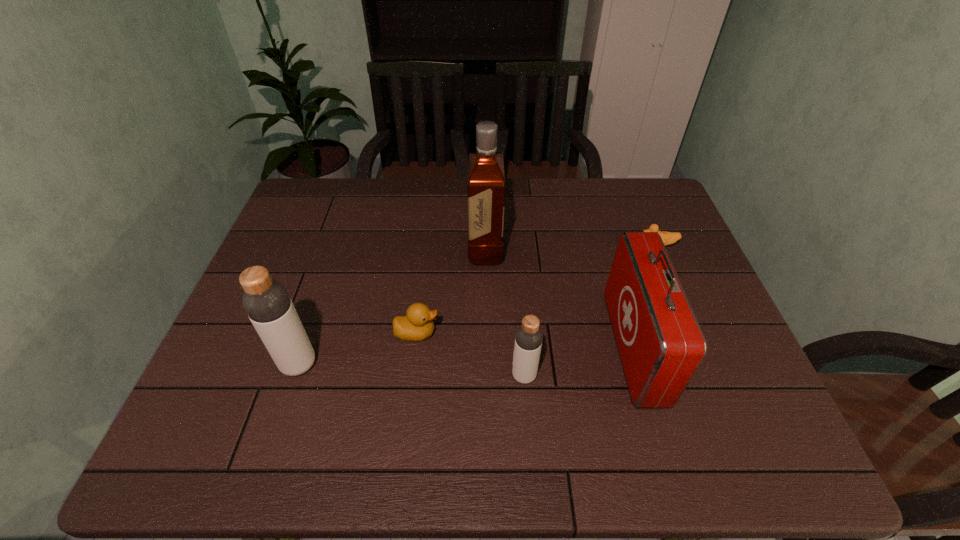
Find the location of a particular element. The width and height of the screenshot is (960, 540). the left bottle is located at coordinates (267, 303).

You are a GUI agent. You are given a task and a screenshot of the screen. Output one action in this format:
    pyautogui.click(x=<x>, y=<y>)
    Task: Click on the leftmost object
    The height and width of the screenshot is (540, 960).
    Given the screenshot: What is the action you would take?
    coord(267,303)

This screenshot has width=960, height=540. I want to click on the shorter bottle, so click(x=528, y=340).

Find the location of a particular element. the right bottle is located at coordinates (528, 340).

Where is `the rightmost object`? The height and width of the screenshot is (540, 960). the rightmost object is located at coordinates (668, 238).

Where is `the shortest object`? The image size is (960, 540). the shortest object is located at coordinates (668, 238).

Locate an element on the screen. The width and height of the screenshot is (960, 540). the fourth object from right to left is located at coordinates (486, 177).

Identify the location of liquor. The width and height of the screenshot is (960, 540). (486, 177).

What are the coordinates of `the left duckling` in the screenshot? It's located at (417, 324).

Locate an element on the screen. the fifth tallest object is located at coordinates (417, 324).